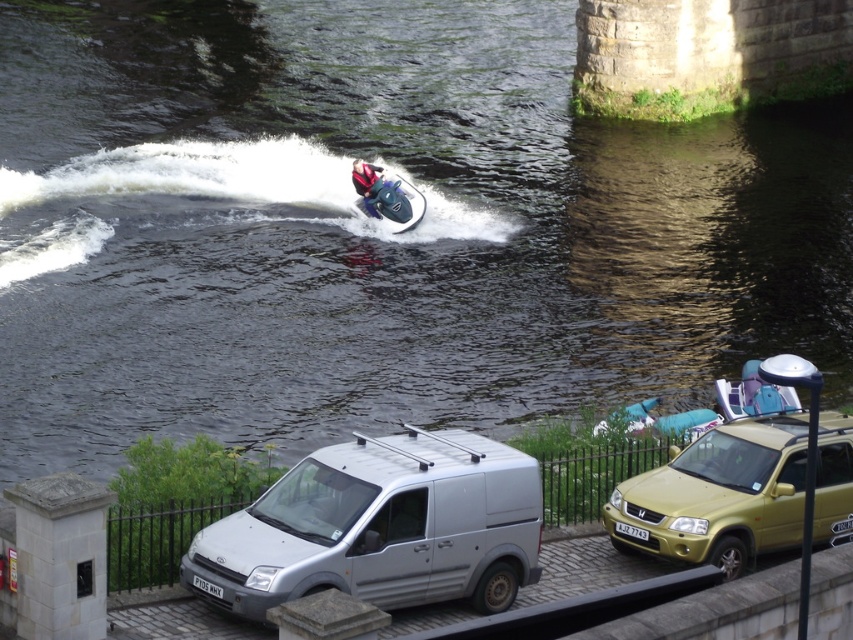
Looking at this image, you are a photographer setting up equipment on the paved area. You need to choose between the silver metallic van at lower center and the gold metallic suv at lower right to place your heavy gear. Which vehicle should you choose if you want to store your gear on the roof without blocking the view of the river through the railing?

The silver metallic van at lower center has a greater height compared to the gold metallic suv at lower right. Therefore, placing gear on its roof would block the view less since it is taller and the gear would be higher up, keeping the railing between the vehicles and the river still visible.

You are a visitor at the riverbank and want to take a photo of the metallic blue jet ski at center without including the gold metallic suv at lower right in the frame. Is it possible to do so by adjusting your camera angle upwards?

The gold metallic suv at lower right is located below the metallic blue jet ski at center, so adjusting the camera angle upwards would allow you to frame the metallic blue jet ski at center without the gold metallic suv at lower right obstructing the view.

In the scene shown: You are a visitor at the riverbank and want to know if the metallic blue jet ski at center is taller than the red fabric helmet at upper center. Can you confirm this?

The metallic blue jet ski at center is much taller than the red fabric helmet at upper center, so yes, the jet ski is taller.